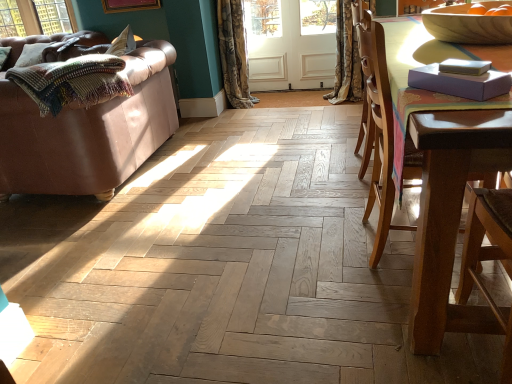
Locate an element on the screen. The image size is (512, 384). wooden bowl at upper right is located at coordinates (467, 26).

The width and height of the screenshot is (512, 384). I want to click on white wood screen door at center, so click(289, 45).

You are a GUI agent. You are given a task and a screenshot of the screen. Output one action in this format:
    pyautogui.click(x=<x>, y=<y>)
    Task: Click on the textured floral curtain at center, arranged as the 1th curtain when viewed from the left
    This screenshot has width=512, height=384.
    Given the screenshot: What is the action you would take?
    pyautogui.click(x=234, y=53)

Where is `leather couch at left`? leather couch at left is located at coordinates (88, 133).

What do you see at coordinates (488, 254) in the screenshot? The image size is (512, 384). I see `matte purple armchair at right` at bounding box center [488, 254].

Where is `wooden bowl at upper right`? The width and height of the screenshot is (512, 384). wooden bowl at upper right is located at coordinates (467, 26).

Would you say leather couch at left is to the left or to the right of white wood screen door at center in the picture?

Clearly, leather couch at left is on the left of white wood screen door at center in the image.

Does point (0, 140) appear closer or farther from the camera than point (298, 9)?

Clearly, point (0, 140) is closer to the camera than point (298, 9).

Who is bigger, leather couch at left or white wood screen door at center?

Bigger between the two is leather couch at left.

Would you say white wood screen door at center is to the left or to the right of wooden bowl at upper right in the picture?

In the image, white wood screen door at center appears on the left side of wooden bowl at upper right.

Which point is more forward, (x=277, y=29) or (x=464, y=13)?

Positioned in front is point (x=464, y=13).

Measure the distance from white wood screen door at center to wooden bowl at upper right.

A distance of 2.55 meters exists between white wood screen door at center and wooden bowl at upper right.

Identify the location of book below the wooden bowl at upper right (from the image's perspective). Image resolution: width=512 pixels, height=384 pixels. (461, 79).

Who is shorter, wooden bowl at upper right or purple matte book at upper right?

Standing shorter between the two is purple matte book at upper right.

Is wooden bowl at upper right positioned with its back to purple matte book at upper right?

No, wooden bowl at upper right is not facing the opposite direction of purple matte book at upper right.

Measure the distance from brown wooden chair at right to purple matte book at upper right.

The distance of brown wooden chair at right from purple matte book at upper right is 13.75 inches.

Is purple matte book at upper right at the back of brown wooden chair at right?

brown wooden chair at right is not turned away from purple matte book at upper right.

In terms of size, does brown wooden chair at right appear bigger or smaller than purple matte book at upper right?

Considering their sizes, brown wooden chair at right takes up more space than purple matte book at upper right.

Between point (429, 45) and point (495, 83), which one is positioned in front?

The point (495, 83) is closer.

The height and width of the screenshot is (384, 512). Find the location of `studio couch lying on the left of wooden bowl at upper right`. studio couch lying on the left of wooden bowl at upper right is located at coordinates (88, 133).

Would you say leather couch at left is part of wooden bowl at upper right's contents?

No, leather couch at left is not a part of wooden bowl at upper right.

In the scene shown: Can you confirm if wooden bowl at upper right is bigger than leather couch at left?

No, wooden bowl at upper right is not bigger than leather couch at left.

Is matte purple armchair at right at the back of wooden bowl at upper right?

No, wooden bowl at upper right is not facing away from matte purple armchair at right.

Can you confirm if wooden bowl at upper right is bigger than matte purple armchair at right?

Incorrect, wooden bowl at upper right is not larger than matte purple armchair at right.

From the image's perspective, is wooden bowl at upper right below matte purple armchair at right?

No, from the image's perspective, wooden bowl at upper right is not beneath matte purple armchair at right.

Which is closer, (x=230, y=85) or (x=38, y=141)?

The point (x=38, y=141) is closer to the camera.

Can you confirm if textured floral curtain at center, arranged as the 1th curtain when viewed from the left, is positioned to the right of leather couch at left?

Correct, you'll find textured floral curtain at center, arranged as the 1th curtain when viewed from the left, to the right of leather couch at left.

From a real-world perspective, which object stands above the other?

In real-world perspective, textured floral curtain at center, placed as the second curtain when sorted from right to left, is above.

Locate an element on the screen. screen door above the leather couch at left (from a real-world perspective) is located at coordinates (289, 45).

Identify the location of screen door lying behind the wooden bowl at upper right. (289, 45).

From the picture: When comparing their distances from matte purple armchair at right, does wooden bowl at upper right or multicolored knitted blanket at left seem further?

Result: Based on the image, multicolored knitted blanket at left appears to be further to matte purple armchair at right.

Looking at the image, which one is located further to white wood screen door at center, wooden bowl at upper right or matte purple armchair at right?

matte purple armchair at right lies further to white wood screen door at center than the other object.

Estimate the real-world distances between objects in this image. Which object is further from white wood screen door at center, textured floral curtain at center, arranged as the 1th curtain when viewed from the left, or brown wooden chair at right?

A: brown wooden chair at right is further to white wood screen door at center.

When comparing their distances from floral fabric curtain at upper right, which is the 1th curtain in right-to-left order, does matte purple armchair at right or leather couch at left seem closer?

Based on the image, leather couch at left appears to be nearer to floral fabric curtain at upper right, which is the 1th curtain in right-to-left order.

From the image, which object appears to be nearer to white wood screen door at center, floral fabric curtain at upper right, which is the second curtain from left to right, or matte purple armchair at right?

Among the two, floral fabric curtain at upper right, which is the second curtain from left to right, is located nearer to white wood screen door at center.

When comparing their distances from leather couch at left, does multicolored knitted blanket at left or wooden bowl at upper right seem further?

wooden bowl at upper right lies further to leather couch at left than the other object.

Based on the photo, estimate the real-world distances between objects in this image. Which object is closer to brown wooden chair at right, multicolored knitted blanket at left or textured floral curtain at center, placed as the second curtain when sorted from right to left?

multicolored knitted blanket at left lies closer to brown wooden chair at right than the other object.

Considering their positions, is wooden bowl at upper right positioned closer to multicolored knitted blanket at left than white wood screen door at center?

Among the two, wooden bowl at upper right is located nearer to multicolored knitted blanket at left.

I want to click on material located between wooden bowl at upper right and white wood screen door at center in the depth direction, so click(x=72, y=82).

This screenshot has width=512, height=384. Find the location of `material between leather couch at left and floral fabric curtain at upper right, which is the second curtain from left to right`. material between leather couch at left and floral fabric curtain at upper right, which is the second curtain from left to right is located at coordinates (72, 82).

Find the location of `book located between leather couch at left and wooden bowl at upper right in the left-right direction`. book located between leather couch at left and wooden bowl at upper right in the left-right direction is located at coordinates (461, 79).

Image resolution: width=512 pixels, height=384 pixels. Find the location of `studio couch between matte purple armchair at right and white wood screen door at center along the z-axis`. studio couch between matte purple armchair at right and white wood screen door at center along the z-axis is located at coordinates (88, 133).